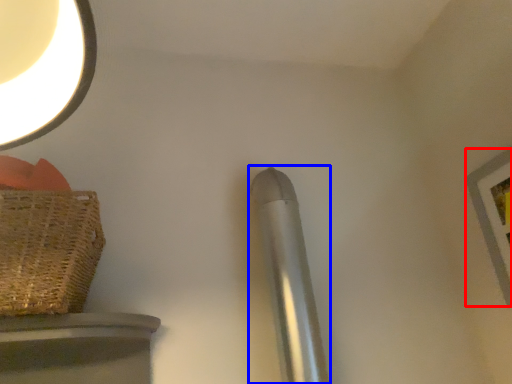
Question: Which of the following is the closest to the observer, picture frame (highlighted by a red box) or steel (highlighted by a blue box)?

Choices:
 (A) picture frame
 (B) steel

Answer: (A)